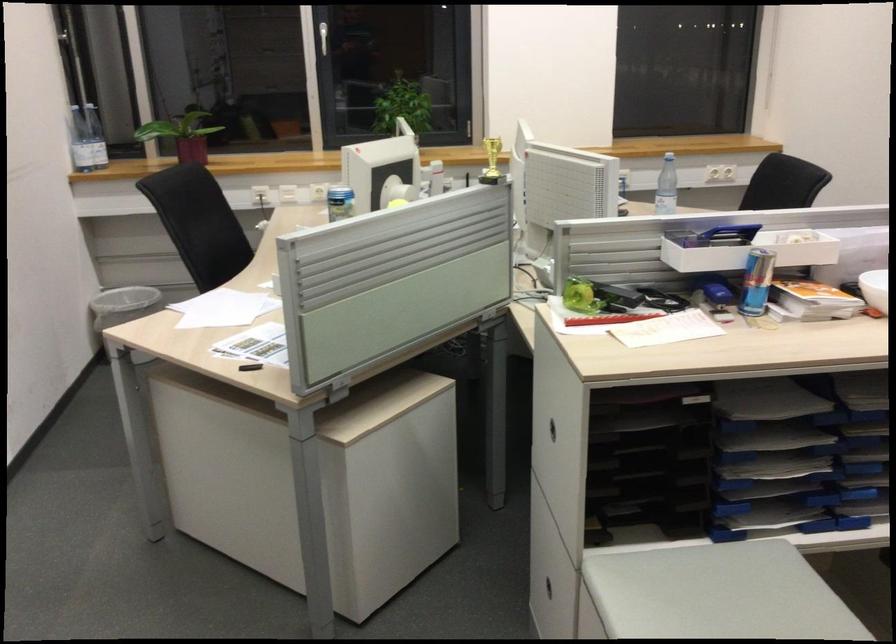
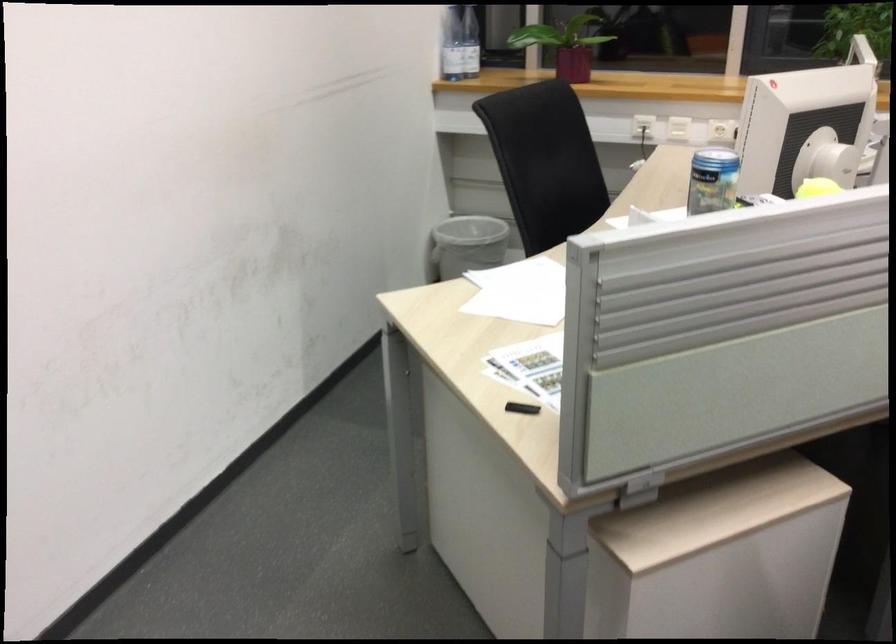
Question: The first image is from the beginning of the video and the second image is from the end. How did the camera likely rotate when shooting the video?

Choices:
 (A) Left
 (B) Right
 (C) Up
 (D) Down

Answer: (A)